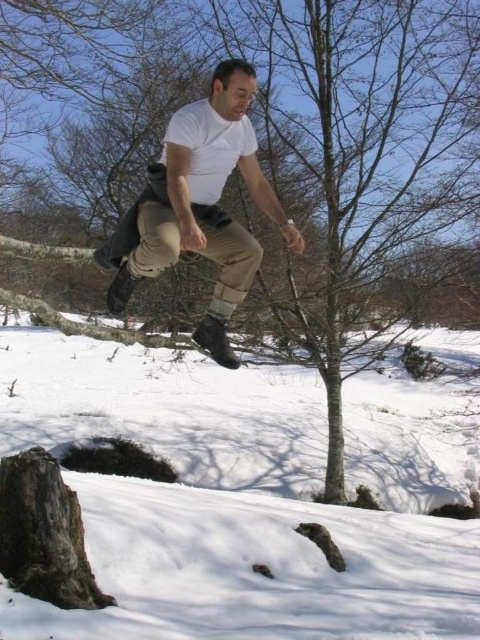
You are a drone operator trying to capture the man midair. The camera is currently focused on the white powdery snow at lower center. To get a clear shot of the man, should you adjust the camera upwards or downwards?

The white powdery snow at lower center is located at point (x=249, y=497). Since the man is midair and the snow is at lower center, you should adjust the camera upwards to capture the man.

You are a drone operator trying to capture the best aerial shot of the man in the snowy landscape. The man is currently jumping over a spot marked by point (249,497). To ensure the snow at that point is clearly visible in the shot, where should you position the drone relative to the man?

The point (249,497) marks white powdery snow at lower center, so you should position the drone above the man and slightly behind him to capture the snow at lower center clearly.